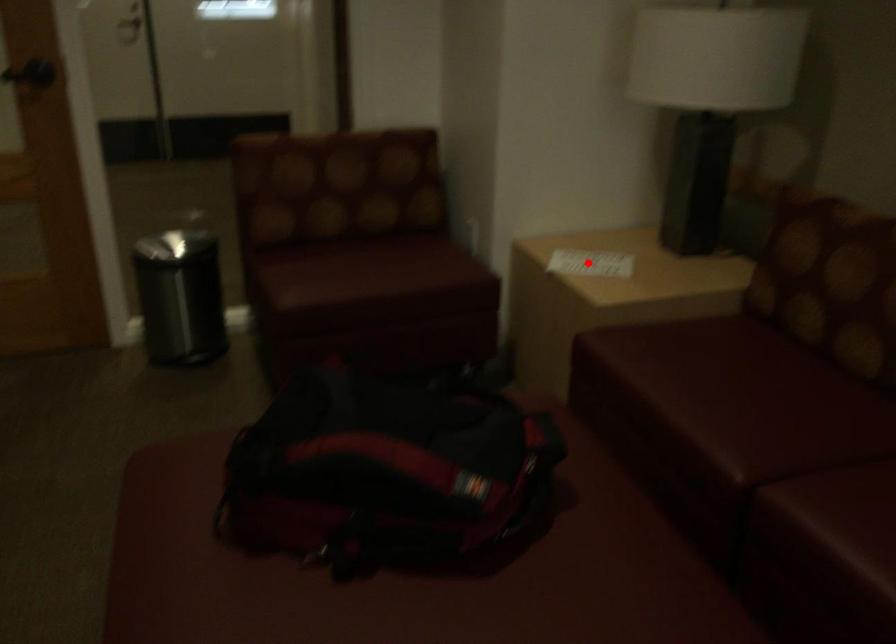
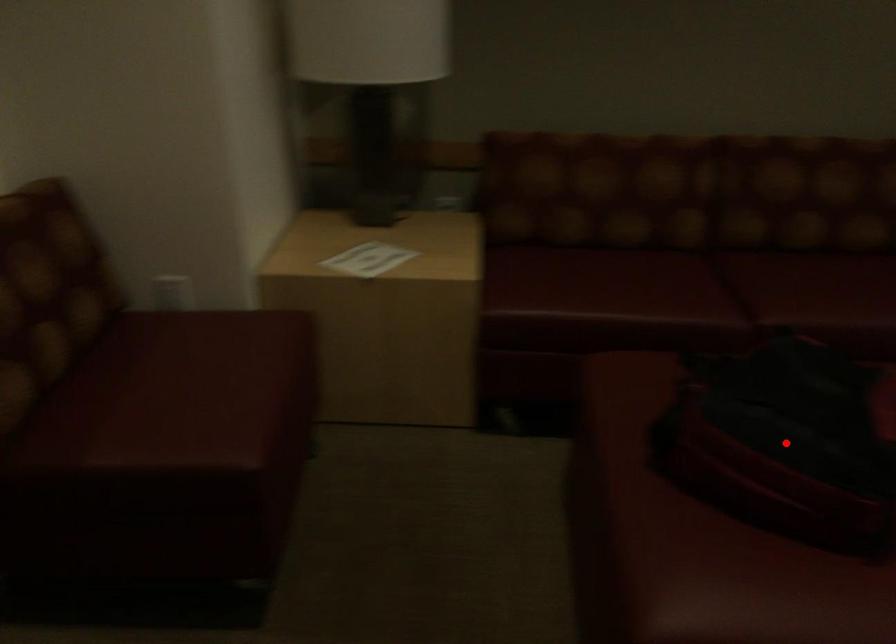
I am providing you with two images of the same scene from different viewpoints. A red point is marked on the first image and another point is marked on the second image. Do the highlighted points in image1 and image2 indicate the same real-world spot?

No